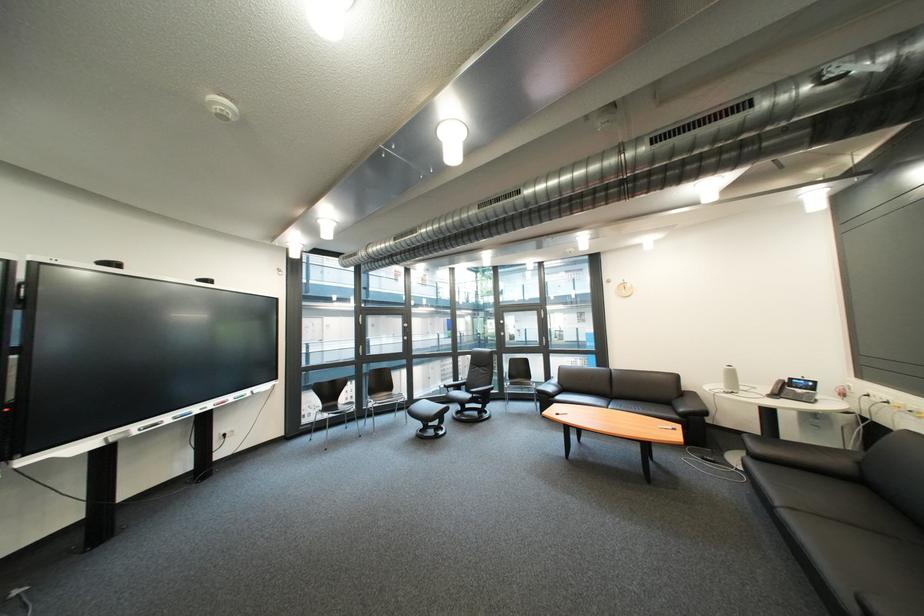
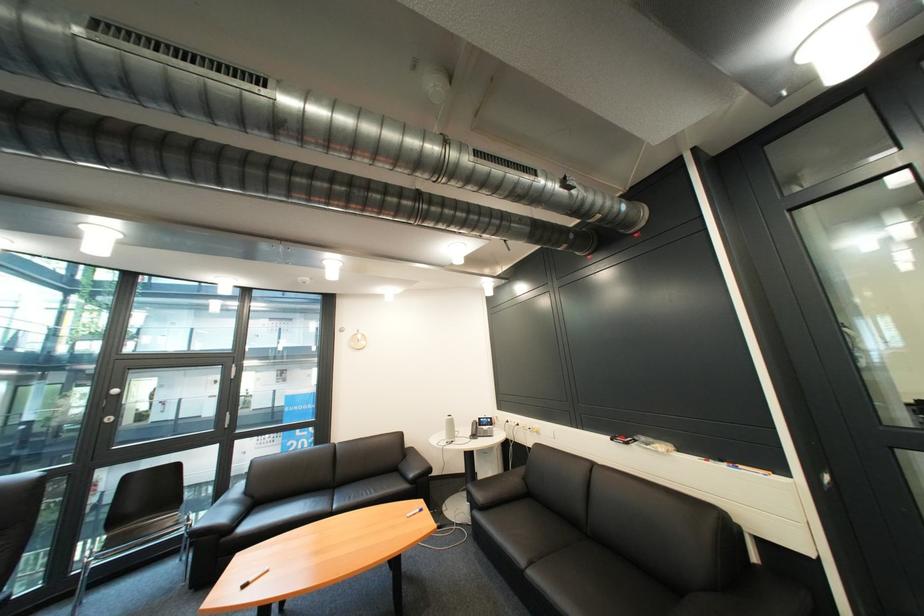
Locate, in the second image, the point that corresponds to (574,387) in the first image.

(262, 503)